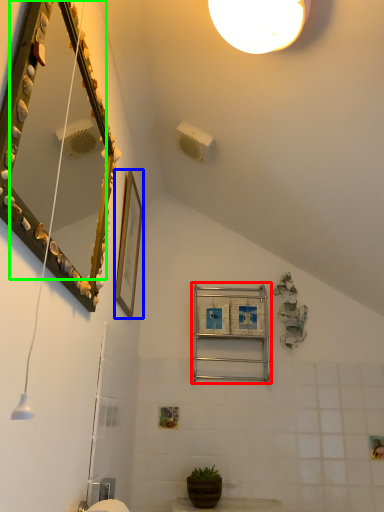
Question: Estimate the real-world distances between objects in this image. Which object is farther from ladder (highlighted by a red box), picture frame (highlighted by a blue box) or mirror (highlighted by a green box)?

Choices:
 (A) picture frame
 (B) mirror

Answer: (B)